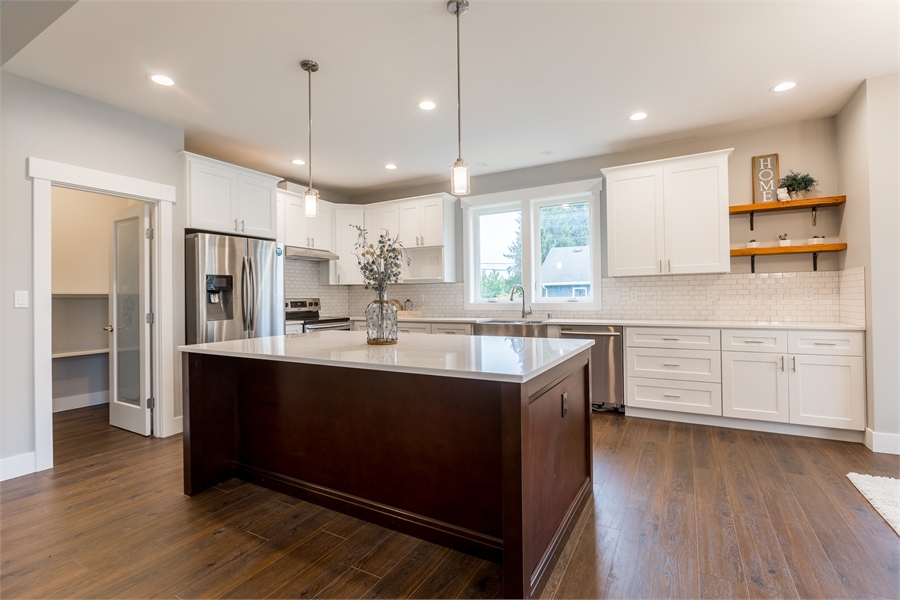
You are a GUI agent. You are given a task and a screenshot of the screen. Output one action in this format:
    pyautogui.click(x=<x>, y=<y>)
    Task: Click on the lights
    The image size is (900, 600).
    Given the screenshot: What is the action you would take?
    pyautogui.click(x=158, y=82), pyautogui.click(x=294, y=160), pyautogui.click(x=310, y=204), pyautogui.click(x=391, y=166), pyautogui.click(x=428, y=103), pyautogui.click(x=462, y=183), pyautogui.click(x=637, y=117), pyautogui.click(x=786, y=85)